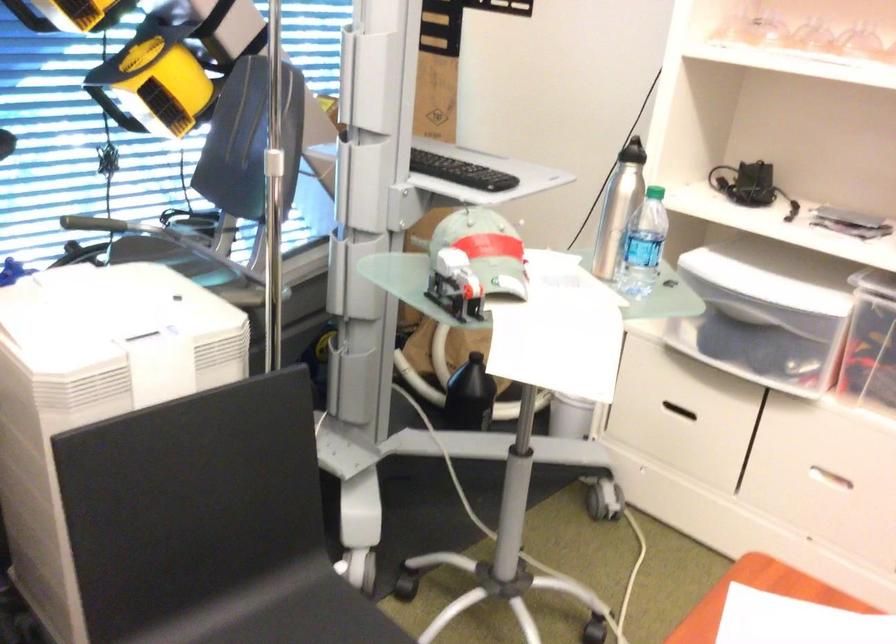
Find the location of a particular element. The width and height of the screenshot is (896, 644). black bottle is located at coordinates (470, 395).